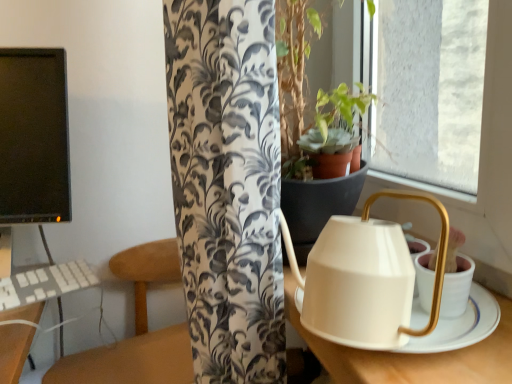
Question: Could you tell me if wooden table at center is turned towards black matte monitor at left?

Choices:
 (A) no
 (B) yes

Answer: (A)

Question: From the image's perspective, is wooden table at center over black matte monitor at left?

Choices:
 (A) yes
 (B) no

Answer: (B)

Question: Can you confirm if wooden table at center is bigger than black matte monitor at left?

Choices:
 (A) no
 (B) yes

Answer: (B)

Question: Considering the relative sizes of wooden table at center and black matte monitor at left in the image provided, is wooden table at center taller than black matte monitor at left?

Choices:
 (A) yes
 (B) no

Answer: (B)

Question: From the image's perspective, is wooden table at center beneath black matte monitor at left?

Choices:
 (A) no
 (B) yes

Answer: (B)

Question: Is wooden table at center located outside black matte monitor at left?

Choices:
 (A) no
 (B) yes

Answer: (B)

Question: Does wooden table at center have a greater width compared to white matte kettle at right?

Choices:
 (A) yes
 (B) no

Answer: (A)

Question: Can you confirm if wooden table at center is positioned to the left of white matte kettle at right?

Choices:
 (A) yes
 (B) no

Answer: (A)

Question: Is white matte kettle at right completely or partially inside wooden table at center?

Choices:
 (A) no
 (B) yes

Answer: (A)

Question: Does wooden table at center have a lesser height compared to white matte kettle at right?

Choices:
 (A) yes
 (B) no

Answer: (B)

Question: Is wooden table at center positioned with its back to white matte kettle at right?

Choices:
 (A) yes
 (B) no

Answer: (B)

Question: Is wooden table at center to the right of white matte kettle at right from the viewer's perspective?

Choices:
 (A) no
 (B) yes

Answer: (A)

Question: Is wooden table at center closer to the viewer compared to white plastic keyboard at lower left?

Choices:
 (A) yes
 (B) no

Answer: (A)